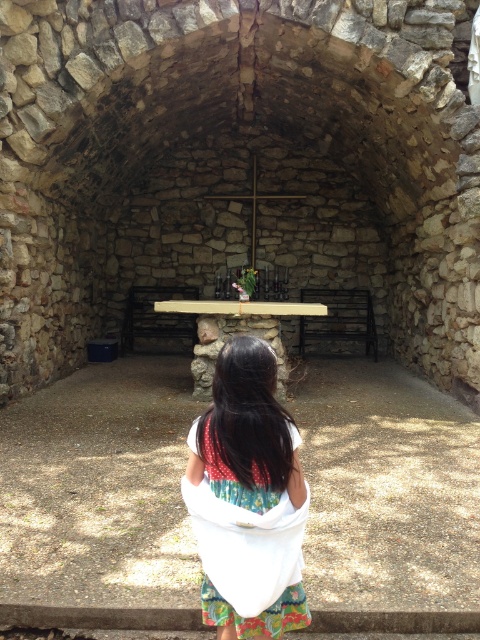
Does brown stone table at center have a lesser height compared to white fabric at center?

Correct, brown stone table at center is not as tall as white fabric at center.

This screenshot has height=640, width=480. What are the coordinates of `brown stone table at center` in the screenshot? It's located at (99, 500).

This screenshot has height=640, width=480. What are the coordinates of `brown stone table at center` in the screenshot? It's located at (99, 500).

Find the location of a particular element. brown stone table at center is located at coordinates (99, 500).